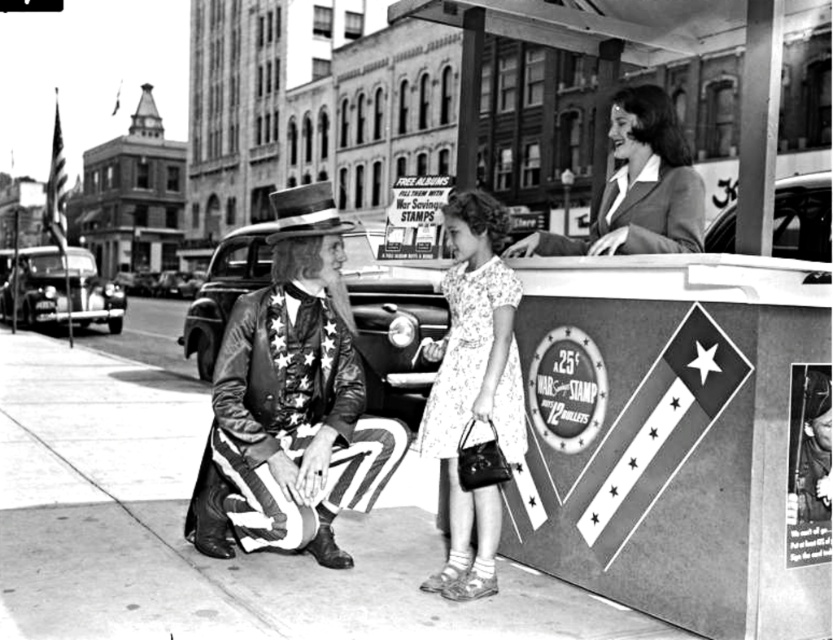
Between leather jacket with stars at center and floral cotton dress at center, which one is positioned higher?

floral cotton dress at center is above.

Is point (308, 518) farther from camera compared to point (451, 531)?

No, it is in front of (451, 531).

You are a GUI agent. You are given a task and a screenshot of the screen. Output one action in this format:
    pyautogui.click(x=<x>, y=<y>)
    Task: Click on the leather jacket with stars at center
    The image size is (833, 640).
    Given the screenshot: What is the action you would take?
    pyautogui.click(x=292, y=403)

Is leather jacket with stars at center shorter than smooth black suit at upper right?

No.

Between point (218, 504) and point (687, 214), which one is positioned in front?

Point (687, 214) is in front.

Is point (338, 332) closer to viewer compared to point (609, 179)?

Yes, point (338, 332) is closer to viewer.

Locate an element on the screen. The width and height of the screenshot is (833, 640). leather jacket with stars at center is located at coordinates (292, 403).

Is floral cotton dress at center to the left of smooth black suit at upper right from the viewer's perspective?

Indeed, floral cotton dress at center is positioned on the left side of smooth black suit at upper right.

Between floral cotton dress at center and smooth black suit at upper right, which one is positioned higher?

Positioned higher is smooth black suit at upper right.

You are a GUI agent. You are given a task and a screenshot of the screen. Output one action in this format:
    pyautogui.click(x=<x>, y=<y>)
    Task: Click on the floral cotton dress at center
    The image size is (833, 640).
    Given the screenshot: What is the action you would take?
    pyautogui.click(x=472, y=387)